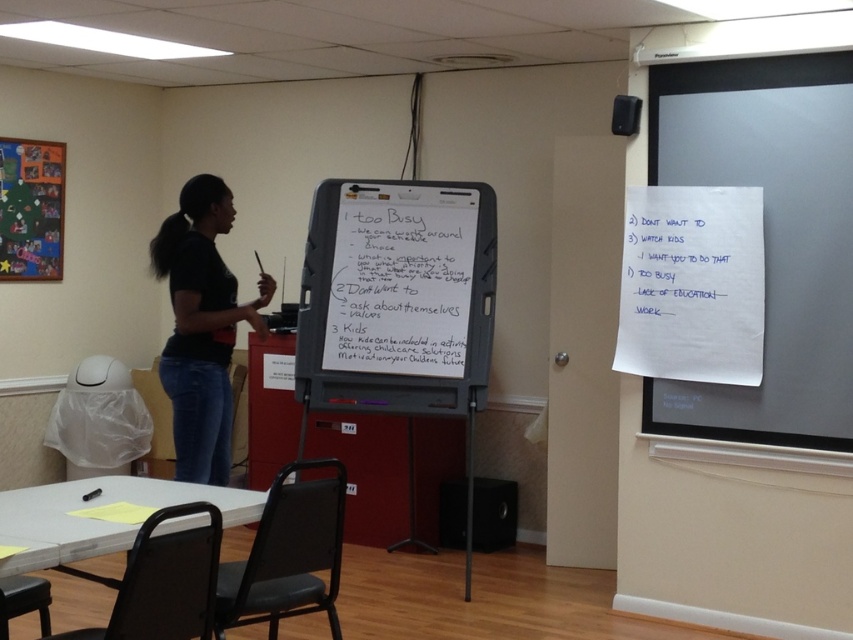
You are a student trying to copy down notes from the whiteboard at center and the white paper at upper right. Which one do you need to move closer to in order to read the content more clearly?

The whiteboard at center has a greater width than the white paper at upper right, so you should move closer to the white paper at upper right to read its content more clearly.

You are organizing a classroom activity and need to place a large poster that requires a surface bigger than the whiteboard at center. Can the white paper at upper right accommodate the poster?

The whiteboard at center is larger than the white paper at upper right, so the white paper at upper right cannot accommodate the poster since it is smaller.

You are a student sitting in the classroom and want to write on the whiteboard at center and the white matte dry erase board at center. Which one can you reach without moving from your seat?

The whiteboard at center is closer to the viewer than the white matte dry erase board at center, so you can reach the whiteboard at center without moving from your seat, but you cannot reach the white matte dry erase board at center.